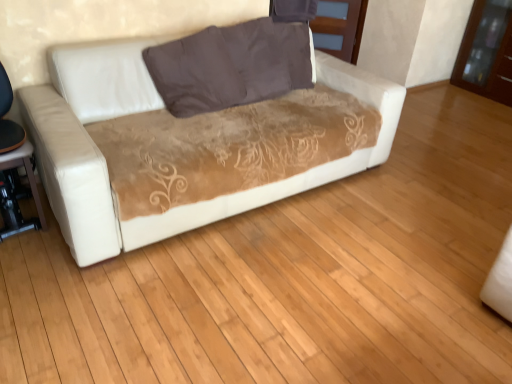
The width and height of the screenshot is (512, 384). What do you see at coordinates (339, 28) in the screenshot? I see `matte brown wood dresser at upper center, placed as the first dresser when sorted from left to right` at bounding box center [339, 28].

Locate an element on the screen. The width and height of the screenshot is (512, 384). matte black table at lower left is located at coordinates (14, 194).

From a real-world perspective, is matte black table at lower left located beneath brown glossy dresser at upper right, the second dresser viewed from the left?

Yes, from a real-world perspective, matte black table at lower left is below brown glossy dresser at upper right, the second dresser viewed from the left.

Between matte black table at lower left and brown glossy dresser at upper right, the second dresser viewed from the left, which one appears on the right side from the viewer's perspective?

From the viewer's perspective, brown glossy dresser at upper right, the second dresser viewed from the left, appears more on the right side.

Is matte black table at lower left inside the boundaries of brown glossy dresser at upper right, the second dresser viewed from the left, or outside?

matte black table at lower left lies outside brown glossy dresser at upper right, the second dresser viewed from the left.

Is brown glossy dresser at upper right, acting as the first dresser starting from the right, at the left side of brown fabric pillow at center?

No.

Considering the sizes of brown glossy dresser at upper right, the second dresser viewed from the left, and brown fabric pillow at center in the image, is brown glossy dresser at upper right, the second dresser viewed from the left, bigger or smaller than brown fabric pillow at center?

brown glossy dresser at upper right, the second dresser viewed from the left, is bigger than brown fabric pillow at center.

Is point (480, 68) positioned in front of point (261, 83)?

No.

Is brown glossy dresser at upper right, acting as the first dresser starting from the right, inside the boundaries of brown fabric pillow at center, or outside?

brown glossy dresser at upper right, acting as the first dresser starting from the right, is not enclosed by brown fabric pillow at center.

In the image, is white leather couch at center positioned in front of or behind matte brown wood dresser at upper center, placed as the first dresser when sorted from left to right?

white leather couch at center is positioned closer to the viewer than matte brown wood dresser at upper center, placed as the first dresser when sorted from left to right.

Does white leather couch at center have a larger size compared to matte brown wood dresser at upper center, acting as the second dresser starting from the right?

Correct, white leather couch at center is larger in size than matte brown wood dresser at upper center, acting as the second dresser starting from the right.

Between white leather couch at center and matte brown wood dresser at upper center, acting as the second dresser starting from the right, which one has more height?

white leather couch at center is taller.

Does white leather couch at center contain matte black table at lower left?

Actually, matte black table at lower left is outside white leather couch at center.

Is white leather couch at center positioned before matte black table at lower left?

Yes, the depth of white leather couch at center is less than that of matte black table at lower left.

Locate an element on the screen. This screenshot has width=512, height=384. table lying on the left of white leather couch at center is located at coordinates (14, 194).

Is white leather couch at center wider than matte black table at lower left?

Indeed, white leather couch at center has a greater width compared to matte black table at lower left.

Considering the relative sizes of white leather couch at center and brown glossy dresser at upper right, acting as the first dresser starting from the right, in the image provided, is white leather couch at center wider than brown glossy dresser at upper right, acting as the first dresser starting from the right,?

Yes.

Based on their positions, is white leather couch at center located to the left or right of brown glossy dresser at upper right, acting as the first dresser starting from the right?

white leather couch at center is positioned on brown glossy dresser at upper right, acting as the first dresser starting from the right,'s left side.

Is point (145, 194) closer or farther from the camera than point (502, 51)?

Point (145, 194) is closer to the camera than point (502, 51).

From the image's perspective, does matte black table at lower left appear lower than white leather couch at center?

Indeed, from the image's perspective, matte black table at lower left is shown beneath white leather couch at center.

From a real-world perspective, between matte black table at lower left and white leather couch at center, who is vertically higher?

white leather couch at center is physically above.

Would you say white leather couch at center is part of matte black table at lower left's contents?

No, matte black table at lower left does not contain white leather couch at center.

How many degrees apart are the facing directions of matte black table at lower left and white leather couch at center?

The facing directions of matte black table at lower left and white leather couch at center are 2.86 degrees apart.

Can you tell me how much brown glossy dresser at upper right, the second dresser viewed from the left, and white leather couch at center differ in facing direction?

90 degrees separate the facing orientations of brown glossy dresser at upper right, the second dresser viewed from the left, and white leather couch at center.

Which is behind, brown glossy dresser at upper right, acting as the first dresser starting from the right, or white leather couch at center?

brown glossy dresser at upper right, acting as the first dresser starting from the right.

Visually, is brown glossy dresser at upper right, the second dresser viewed from the left, positioned to the left or to the right of white leather couch at center?

Clearly, brown glossy dresser at upper right, the second dresser viewed from the left, is on the right of white leather couch at center in the image.

Image resolution: width=512 pixels, height=384 pixels. Find the location of `the 1st dresser above the matte black table at lower left (from the image's perspective)`. the 1st dresser above the matte black table at lower left (from the image's perspective) is located at coordinates (487, 51).

From a real-world perspective, count 1st dressers downward from the brown fabric pillow at center and point to it. Please provide its 2D coordinates.

[(487, 51)]

When comparing their distances from brown fabric pillow at center, does matte black table at lower left or brown glossy dresser at upper right, acting as the first dresser starting from the right, seem closer?

Among the two, matte black table at lower left is located nearer to brown fabric pillow at center.

Estimate the real-world distances between objects in this image. Which object is closer to white leather couch at center, matte brown wood dresser at upper center, acting as the second dresser starting from the right, or brown glossy dresser at upper right, the second dresser viewed from the left?

Based on the image, matte brown wood dresser at upper center, acting as the second dresser starting from the right, appears to be nearer to white leather couch at center.

Which object lies nearer to the anchor point white leather couch at center, matte black table at lower left or brown glossy dresser at upper right, the second dresser viewed from the left?

The object closer to white leather couch at center is matte black table at lower left.

From the image, which object appears to be nearer to matte brown wood dresser at upper center, placed as the first dresser when sorted from left to right, brown glossy dresser at upper right, the second dresser viewed from the left, or brown fabric pillow at center?

Based on the image, brown glossy dresser at upper right, the second dresser viewed from the left, appears to be nearer to matte brown wood dresser at upper center, placed as the first dresser when sorted from left to right.

Considering their positions, is matte black table at lower left positioned further to brown glossy dresser at upper right, the second dresser viewed from the left, than brown fabric pillow at center?

Based on the image, matte black table at lower left appears to be further to brown glossy dresser at upper right, the second dresser viewed from the left.

Looking at the image, which one is located closer to matte black table at lower left, white leather couch at center or brown glossy dresser at upper right, the second dresser viewed from the left?

The object closer to matte black table at lower left is white leather couch at center.

From the image, which object appears to be nearer to brown fabric pillow at center, white leather couch at center or matte brown wood dresser at upper center, placed as the first dresser when sorted from left to right?

white leather couch at center lies closer to brown fabric pillow at center than the other object.

Looking at the image, which one is located further to brown glossy dresser at upper right, acting as the first dresser starting from the right, white leather couch at center or matte black table at lower left?

matte black table at lower left is positioned further to the anchor brown glossy dresser at upper right, acting as the first dresser starting from the right.

Locate an element on the screen. The width and height of the screenshot is (512, 384). pillow located between matte black table at lower left and brown glossy dresser at upper right, the second dresser viewed from the left, in the left-right direction is located at coordinates (270, 57).

The height and width of the screenshot is (384, 512). I want to click on dresser between matte black table at lower left and brown glossy dresser at upper right, acting as the first dresser starting from the right, in the horizontal direction, so click(339, 28).

Locate an element on the screen. This screenshot has width=512, height=384. pillow between matte black table at lower left and matte brown wood dresser at upper center, acting as the second dresser starting from the right, along the z-axis is located at coordinates (270, 57).

I want to click on pillow between white leather couch at center and brown glossy dresser at upper right, the second dresser viewed from the left, so click(270, 57).